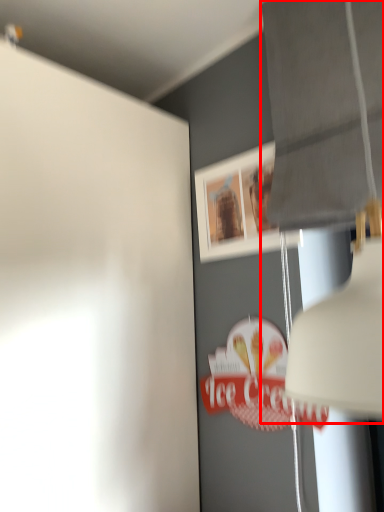
Question: From the image, what is the correct spatial relationship of lamp (annotated by the red box) in relation to picture frame?

Choices:
 (A) right
 (B) left

Answer: (A)